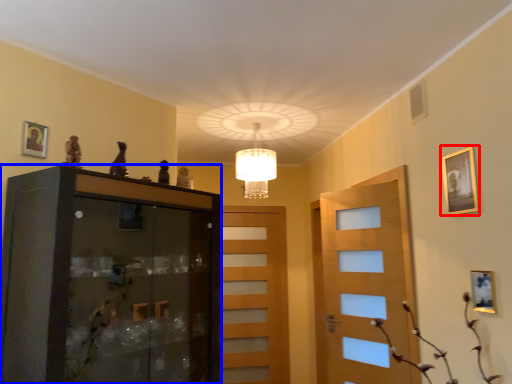
Question: Which point is closer to the camera, picture frame (highlighted by a red box) or cabinetry (highlighted by a blue box)?

Choices:
 (A) picture frame
 (B) cabinetry

Answer: (B)